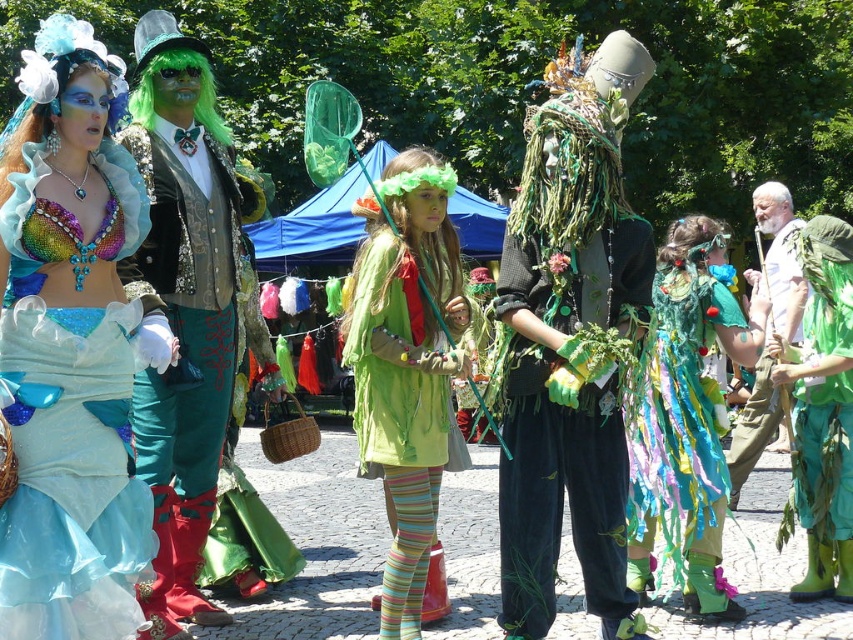
Is point (3, 202) more distant than point (544, 499)?

No, (3, 202) is closer to viewer.

Is shiny sequin top at left bigger than velvet green gloves at center?

Indeed, shiny sequin top at left has a larger size compared to velvet green gloves at center.

Is point (10, 566) behind point (610, 429)?

No, it is in front of (610, 429).

You are a GUI agent. You are given a task and a screenshot of the screen. Output one action in this format:
    pyautogui.click(x=<x>, y=<y>)
    Task: Click on the shiny sequin top at left
    This screenshot has height=640, width=853.
    Given the screenshot: What is the action you would take?
    pyautogui.click(x=70, y=348)

Between point (618, 460) and point (677, 474), which one is positioned behind?

Positioned behind is point (677, 474).

Is velvet green gloves at center to the right of shiny teal fabric dress at center from the viewer's perspective?

Incorrect, velvet green gloves at center is not on the right side of shiny teal fabric dress at center.

Does point (643, 312) come farther from viewer compared to point (720, 561)?

No, (643, 312) is in front of (720, 561).

Locate an element on the screen. Image resolution: width=853 pixels, height=640 pixels. velvet green gloves at center is located at coordinates (564, 426).

This screenshot has width=853, height=640. What do you see at coordinates (192, 342) in the screenshot?
I see `shiny green fabric pants at left` at bounding box center [192, 342].

Where is `shiny green fabric pants at left`? shiny green fabric pants at left is located at coordinates (192, 342).

Is point (210, 356) positioned after point (633, 602)?

Yes.

Locate an element on the screen. This screenshot has height=640, width=853. shiny green fabric pants at left is located at coordinates (192, 342).